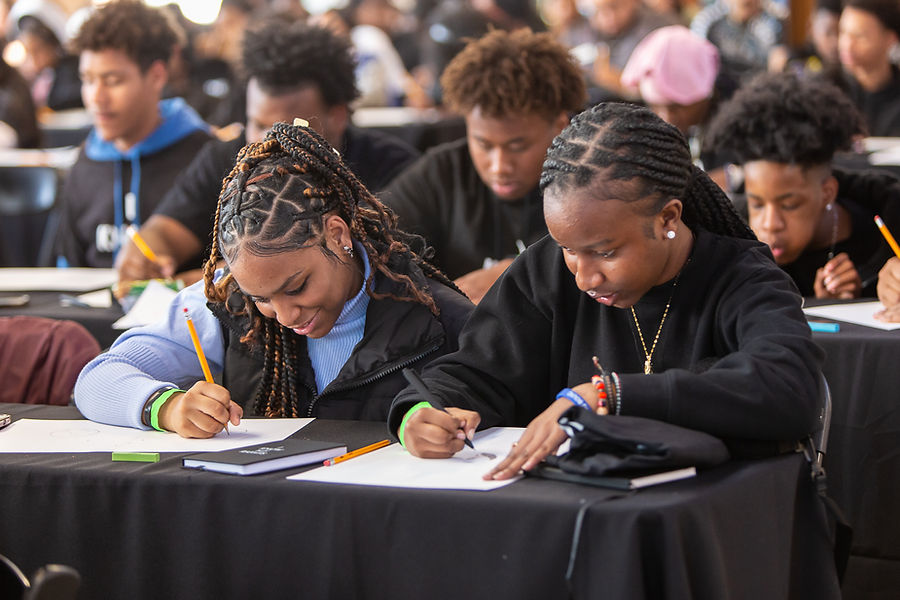
At what (x,y) coordinates should I click in order to perform the action: click on empty chairs. Please return your answer as a coordinate pair (x, y). This screenshot has width=900, height=600. Looking at the image, I should click on (12, 196), (40, 342).